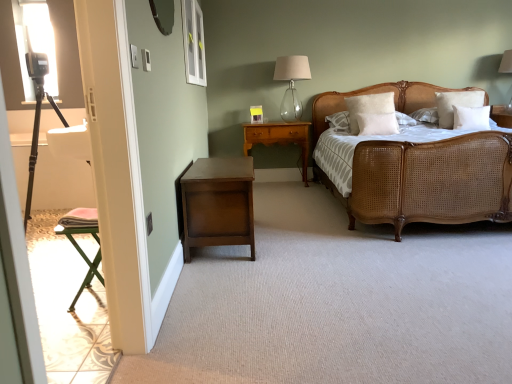
Describe the element at coordinates (163, 15) in the screenshot. Image resolution: width=512 pixels, height=384 pixels. I see `matte silver mirror at upper center` at that location.

I want to click on white soft pillow at upper right, which is the 2th pillow from right to left, so click(x=471, y=118).

The width and height of the screenshot is (512, 384). I want to click on white soft pillow at upper right, which is the fourth pillow from left to right, so click(456, 104).

This screenshot has height=384, width=512. Describe the element at coordinates (194, 43) in the screenshot. I see `transparent glass window at upper center` at that location.

This screenshot has height=384, width=512. Identify the location of dark wood nightstand at lower left, marked as the first nightstand in a front-to-back arrangement. pyautogui.click(x=218, y=203).

Is dark wood nightstand at lower left, the second nightstand positioned from the back, closer to camera compared to wooden nightstand at center, marked as the second nightstand in a front-to-back arrangement?

Yes, dark wood nightstand at lower left, the second nightstand positioned from the back, is closer to the viewer.

Consider the image. From their relative heights in the image, would you say dark wood nightstand at lower left, marked as the first nightstand in a front-to-back arrangement, is taller or shorter than wooden nightstand at center, marked as the second nightstand in a front-to-back arrangement?

Clearly, dark wood nightstand at lower left, marked as the first nightstand in a front-to-back arrangement, is shorter compared to wooden nightstand at center, marked as the second nightstand in a front-to-back arrangement.

Can you tell me how much dark wood nightstand at lower left, the second nightstand positioned from the back, and wooden nightstand at center, the first nightstand positioned from the back, differ in facing direction?

The angular difference between dark wood nightstand at lower left, the second nightstand positioned from the back, and wooden nightstand at center, the first nightstand positioned from the back, is 92.1 degrees.

Considering the relative sizes of dark wood nightstand at lower left, the second nightstand positioned from the back, and wooden nightstand at center, marked as the second nightstand in a front-to-back arrangement, in the image provided, is dark wood nightstand at lower left, the second nightstand positioned from the back, thinner than wooden nightstand at center, marked as the second nightstand in a front-to-back arrangement,?

Incorrect, the width of dark wood nightstand at lower left, the second nightstand positioned from the back, is not less than that of wooden nightstand at center, marked as the second nightstand in a front-to-back arrangement.

Which object is further away from the camera, dark wood nightstand at lower left, the second nightstand positioned from the back, or transparent glass window at upper center?

transparent glass window at upper center is further away from the camera.

Looking at their sizes, would you say dark wood nightstand at lower left, marked as the first nightstand in a front-to-back arrangement, is wider or thinner than transparent glass window at upper center?

Considering their sizes, dark wood nightstand at lower left, marked as the first nightstand in a front-to-back arrangement, looks broader than transparent glass window at upper center.

From the picture: What's the angular difference between dark wood nightstand at lower left, marked as the first nightstand in a front-to-back arrangement, and transparent glass window at upper center's facing directions?

0.398 degrees.

Can you confirm if white soft pillow at upper center, placed as the 1th pillow when sorted from left to right, is shorter than clear glass table lamp at upper center?

Indeed, white soft pillow at upper center, placed as the 1th pillow when sorted from left to right, has a lesser height compared to clear glass table lamp at upper center.

What's the angular difference between white soft pillow at upper center, placed as the 1th pillow when sorted from left to right, and clear glass table lamp at upper center's facing directions?

The angular difference between white soft pillow at upper center, placed as the 1th pillow when sorted from left to right, and clear glass table lamp at upper center is 3.82 degrees.

Which is more to the left, white soft pillow at upper center, placed as the 1th pillow when sorted from left to right, or clear glass table lamp at upper center?

Positioned to the left is clear glass table lamp at upper center.

Considering the sizes of white soft pillow at upper center, placed as the fourth pillow when sorted from right to left, and clear glass table lamp at upper center in the image, is white soft pillow at upper center, placed as the fourth pillow when sorted from right to left, bigger or smaller than clear glass table lamp at upper center?

In the image, white soft pillow at upper center, placed as the fourth pillow when sorted from right to left, appears to be smaller than clear glass table lamp at upper center.

From a real-world perspective, starting from the white soft pillow at upper center, placed as the fourth pillow when sorted from right to left, which pillow is the 3rd one below it? Please provide its 2D coordinates.

[(377, 123)]

Could you tell me if white soft pillow at center, the second pillow in the left-to-right sequence, is turned towards white soft pillow at upper center, placed as the 1th pillow when sorted from left to right?

No, white soft pillow at center, the second pillow in the left-to-right sequence, is not oriented towards white soft pillow at upper center, placed as the 1th pillow when sorted from left to right.

Which object is wider, white soft pillow at center, which is the 3th pillow from right to left, or white soft pillow at upper center, placed as the fourth pillow when sorted from right to left?

Wider between the two is white soft pillow at center, which is the 3th pillow from right to left.

Is clear glass table lamp at upper center turned away from white soft pillow at upper right, which is the fourth pillow from left to right?

That's not correct — clear glass table lamp at upper center is not looking away from white soft pillow at upper right, which is the fourth pillow from left to right.

From the image's perspective, is clear glass table lamp at upper center beneath white soft pillow at upper right, the first pillow in the right-to-left sequence?

Actually, clear glass table lamp at upper center appears above white soft pillow at upper right, the first pillow in the right-to-left sequence, in the image.

Does clear glass table lamp at upper center touch white soft pillow at upper right, the first pillow in the right-to-left sequence?

clear glass table lamp at upper center and white soft pillow at upper right, the first pillow in the right-to-left sequence, are clearly separated.

The width and height of the screenshot is (512, 384). I want to click on the 4th pillow to the right of the clear glass table lamp at upper center, counting from the anchor's position, so click(456, 104).

Considering the relative sizes of matte silver mirror at upper center and white soft pillow at center, which is the 3th pillow from right to left, in the image provided, is matte silver mirror at upper center wider than white soft pillow at center, which is the 3th pillow from right to left,?

In fact, matte silver mirror at upper center might be narrower than white soft pillow at center, which is the 3th pillow from right to left.

From the image's perspective, is matte silver mirror at upper center positioned above or below white soft pillow at center, the second pillow in the left-to-right sequence?

Clearly, from the image's perspective, matte silver mirror at upper center is above white soft pillow at center, the second pillow in the left-to-right sequence.

Is matte silver mirror at upper center taller than white soft pillow at center, the second pillow in the left-to-right sequence?

Yes.

From a real-world perspective, is matte silver mirror at upper center physically above white soft pillow at center, the second pillow in the left-to-right sequence?

Yes, from a real-world perspective, matte silver mirror at upper center is above white soft pillow at center, the second pillow in the left-to-right sequence.

Does point (380, 107) lie behind point (183, 33)?

Yes, it is behind point (183, 33).

Does white soft pillow at upper center, placed as the 1th pillow when sorted from left to right, have a greater width compared to transparent glass window at upper center?

Correct, the width of white soft pillow at upper center, placed as the 1th pillow when sorted from left to right, exceeds that of transparent glass window at upper center.

Does white soft pillow at upper center, placed as the fourth pillow when sorted from right to left, have a smaller size compared to transparent glass window at upper center?

Actually, white soft pillow at upper center, placed as the fourth pillow when sorted from right to left, might be larger than transparent glass window at upper center.

Is white soft pillow at upper center, placed as the fourth pillow when sorted from right to left, outside of transparent glass window at upper center?

That's correct, white soft pillow at upper center, placed as the fourth pillow when sorted from right to left, is outside of transparent glass window at upper center.

Where is `nightstand above the dark wood nightstand at lower left, the second nightstand positioned from the back (from a real-world perspective)`? The image size is (512, 384). nightstand above the dark wood nightstand at lower left, the second nightstand positioned from the back (from a real-world perspective) is located at coordinates (279, 138).

Locate an element on the screen. The image size is (512, 384). the 1st nightstand to the right of the transparent glass window at upper center, counting from the anchor's position is located at coordinates (218, 203).

Considering their positions, is white soft pillow at center, the second pillow in the left-to-right sequence, positioned closer to white soft pillow at upper right, the first pillow in the right-to-left sequence, than transparent glass window at upper center?

white soft pillow at center, the second pillow in the left-to-right sequence.

Which object lies further to the anchor point dark wood nightstand at lower left, the second nightstand positioned from the back, clear glass table lamp at upper center or woven cane bed at center?

clear glass table lamp at upper center is positioned further to the anchor dark wood nightstand at lower left, the second nightstand positioned from the back.

From the image, which object appears to be nearer to white soft pillow at upper right, marked as the third pillow in a left-to-right arrangement, wooden nightstand at center, the first nightstand positioned from the back, or woven cane bed at center?

The object closer to white soft pillow at upper right, marked as the third pillow in a left-to-right arrangement, is woven cane bed at center.

When comparing their distances from white soft pillow at center, which is the 3th pillow from right to left, does clear glass table lamp at upper center or white soft pillow at upper right, which is the 2th pillow from right to left, seem further?

The object further to white soft pillow at center, which is the 3th pillow from right to left, is clear glass table lamp at upper center.

From the image, which object appears to be farther from clear glass table lamp at upper center, white soft pillow at center, the second pillow in the left-to-right sequence, or transparent glass window at upper center?

transparent glass window at upper center is positioned further to the anchor clear glass table lamp at upper center.

Based on the photo, based on their spatial positions, is dark wood nightstand at lower left, the second nightstand positioned from the back, or transparent glass window at upper center closer to clear glass table lamp at upper center?

The object closer to clear glass table lamp at upper center is transparent glass window at upper center.

From the image, which object appears to be farther from wooden nightstand at center, marked as the second nightstand in a front-to-back arrangement, clear glass table lamp at upper center or white soft pillow at center, which is the 3th pillow from right to left?

Among the two, white soft pillow at center, which is the 3th pillow from right to left, is located further to wooden nightstand at center, marked as the second nightstand in a front-to-back arrangement.

Estimate the real-world distances between objects in this image. Which object is further from white soft pillow at upper right, marked as the third pillow in a left-to-right arrangement, white soft pillow at upper right, the first pillow in the right-to-left sequence, or woven cane bed at center?

woven cane bed at center is further to white soft pillow at upper right, marked as the third pillow in a left-to-right arrangement.

I want to click on pillow between woven cane bed at center and white soft pillow at center, the second pillow in the left-to-right sequence, along the z-axis, so click(x=471, y=118).

This screenshot has height=384, width=512. I want to click on pillow between clear glass table lamp at upper center and white soft pillow at center, which is the 3th pillow from right to left, so (372, 113).

Find the location of a particular element. table lamp between transparent glass window at upper center and wooden nightstand at center, the first nightstand positioned from the back, from front to back is located at coordinates (291, 84).

Locate an element on the screen. The height and width of the screenshot is (384, 512). mirror between transparent glass window at upper center and dark wood nightstand at lower left, marked as the first nightstand in a front-to-back arrangement, in the up-down direction is located at coordinates (163, 15).